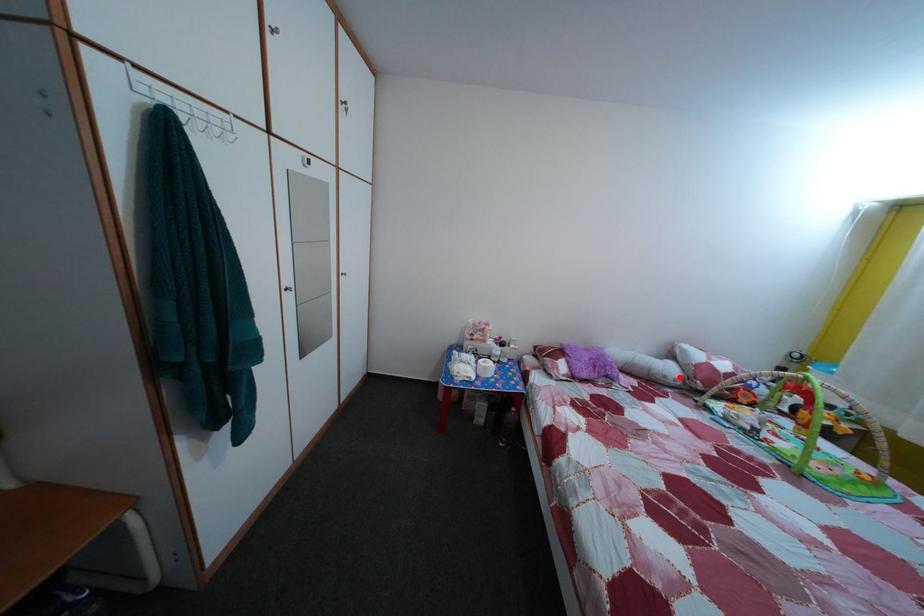
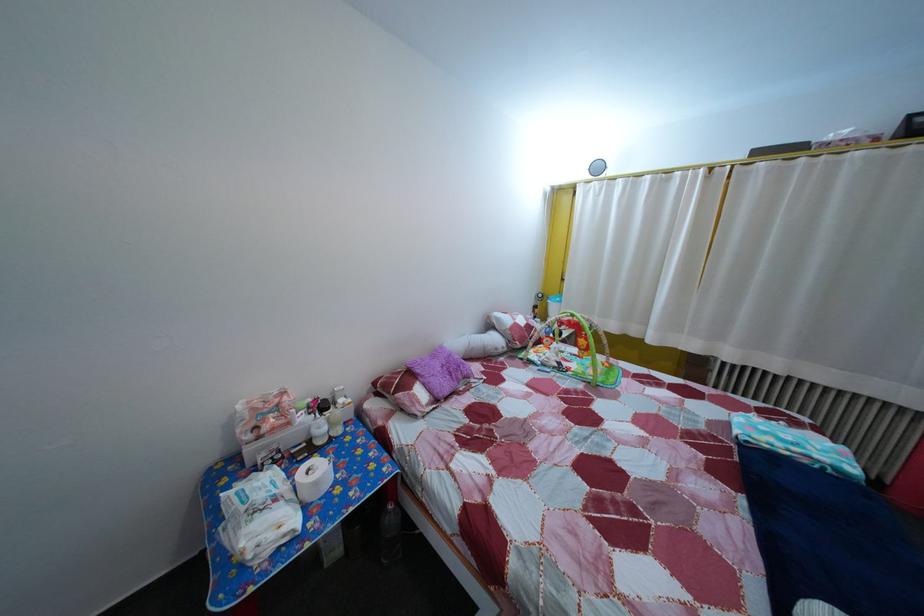
In the second image, find the point that corresponds to the highlighted location in the first image.

(505, 347)